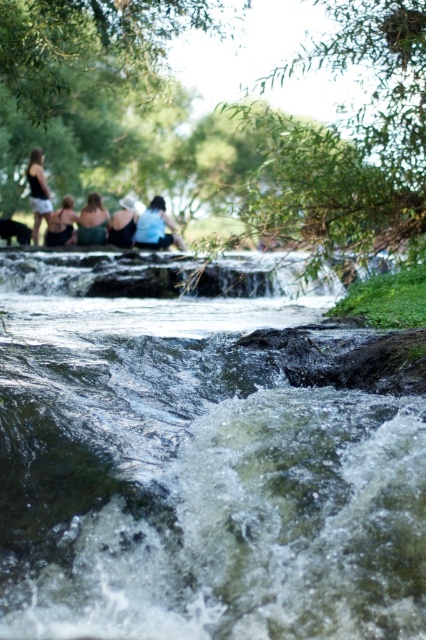
You are a photographer trying to capture a photo of the two people wearing the matte green tank top at center and the matte black tank top at upper left. Based on their positions, which person should you focus on first to ensure they are in the foreground of your photo?

The matte green tank top at center has a greater height compared to the matte black tank top at upper left, so focusing on the matte green tank top at center first would place them in the foreground since they are taller and closer to the viewer.

You are organizing a clothing donation drive and need to categorize the blue fabric shirt at center and the matte green tank top at center based on their sizes. Which one should you place in the large size bin?

The blue fabric shirt at center has a larger size compared to the matte green tank top at center, so it should be placed in the large size bin.